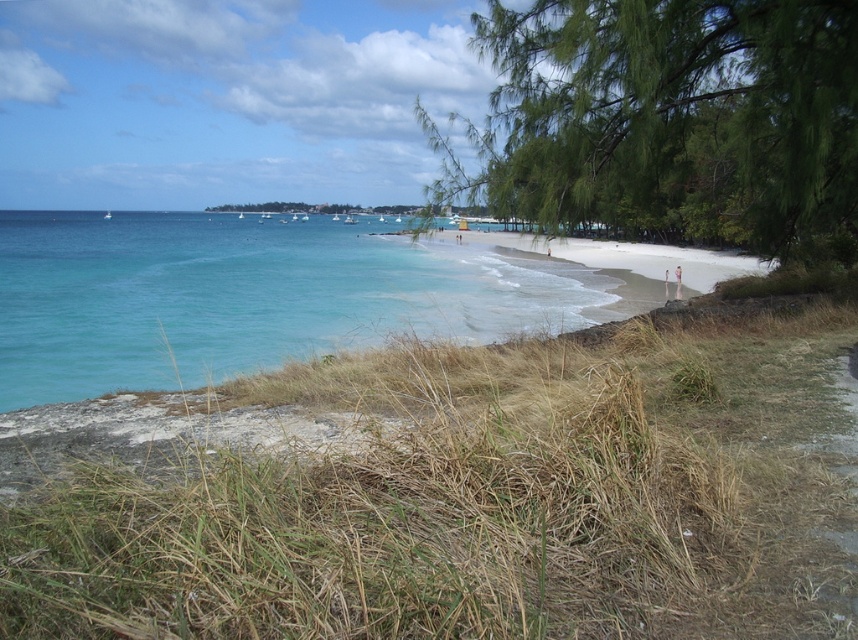
You are standing at the beach looking out towards the sea. There are two points marked in the image, one at coordinate point (x=760, y=244) and another at point (x=171, y=324). Which point is closer to you?

Point (x=760, y=244) is closer to the camera than point (x=171, y=324), so the point at (x=760, y=244) is closer to you.

You are standing at the center of the beach and want to take a photo of the green leafy tree at upper right. In which direction should you point your camera to capture it?

The green leafy tree at upper right is located at point coordinates of (669, 120), so you should point your camera towards the upper right direction to capture it.

You are a photographer planning to capture the coastal scene. You want to ensure that the green leafy tree at upper right and the turquoise water at left are both visible in your shot. Based on their sizes in the image, which object should you prioritize framing closer to the edge of the photo to avoid overcrowding?

The green leafy tree at upper right is thinner than the turquoise water at left, so you should prioritize framing the thinner green leafy tree at upper right closer to the edge to avoid overcrowding since it takes up less space.